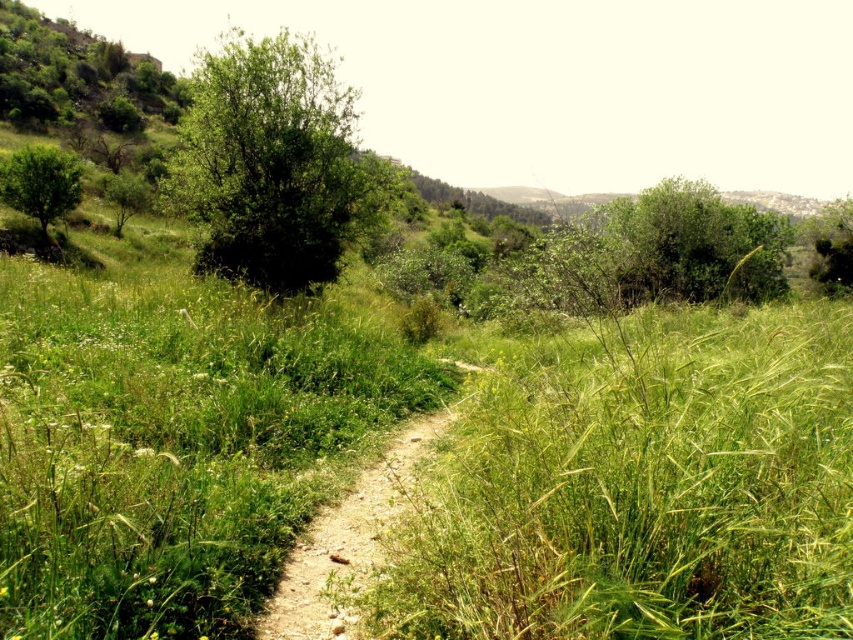
You are a hiker trying to follow the dirt path at center through the green leafy tree at left. Based on their widths, which one is narrower?

The dirt path at center is thinner than the green leafy tree at left, so the dirt path at center is narrower.

You are a hiker standing at the start of the dirt path at center. You want to reach the green leafy tree at upper right. Which direction should you walk to get closer to the tree?

You should walk forward along the dirt path at center since it is closer to you than the green leafy tree at upper right, so moving forward along the path will lead you toward the tree.

You are a hiker standing at the start of the dirt path and want to reach the green leafy tree at left. There is a green leafy bush at center blocking your path. Can you walk around it to get to the tree?

The green leafy bush at center is closer to the viewer than the green leafy tree at left, so you can walk around it to reach the tree.